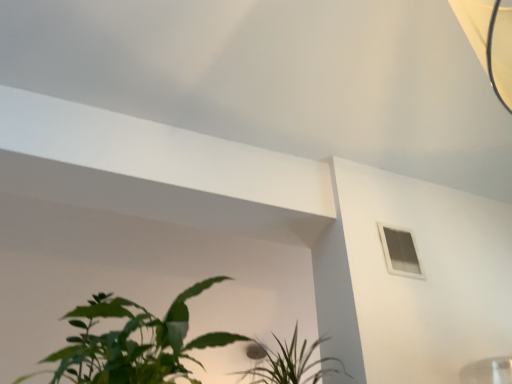
Question: Could you tell me if white plastic window at upper right is turned towards green leafy plant at lower center?

Choices:
 (A) yes
 (B) no

Answer: (B)

Question: From a real-world perspective, is white plastic window at upper right beneath green leafy plant at lower center?

Choices:
 (A) yes
 (B) no

Answer: (B)

Question: Can you confirm if white plastic window at upper right is thinner than green leafy plant at lower center?

Choices:
 (A) yes
 (B) no

Answer: (A)

Question: Does white plastic window at upper right lie in front of green leafy plant at lower center?

Choices:
 (A) no
 (B) yes

Answer: (A)

Question: Is white plastic window at upper right positioned with its back to green leafy plant at lower center?

Choices:
 (A) no
 (B) yes

Answer: (A)

Question: From the image's perspective, is white plastic window at upper right on top of green leafy plant at lower center?

Choices:
 (A) yes
 (B) no

Answer: (A)

Question: Considering the relative sizes of green leafy plant at lower center and white plastic window at upper right in the image provided, is green leafy plant at lower center taller than white plastic window at upper right?

Choices:
 (A) yes
 (B) no

Answer: (B)

Question: Can you confirm if green leafy plant at lower center is thinner than white plastic window at upper right?

Choices:
 (A) no
 (B) yes

Answer: (A)

Question: Can you confirm if green leafy plant at lower center is bigger than white plastic window at upper right?

Choices:
 (A) yes
 (B) no

Answer: (A)

Question: Is green leafy plant at lower center facing away from white plastic window at upper right?

Choices:
 (A) no
 (B) yes

Answer: (A)

Question: Does green leafy plant at lower center have a smaller size compared to white plastic window at upper right?

Choices:
 (A) yes
 (B) no

Answer: (B)

Question: From a real-world perspective, is green leafy plant at lower center beneath white plastic window at upper right?

Choices:
 (A) no
 (B) yes

Answer: (B)

Question: From a real-world perspective, is white plastic window at upper right physically located above or below green leafy plant at lower center?

Choices:
 (A) below
 (B) above

Answer: (B)